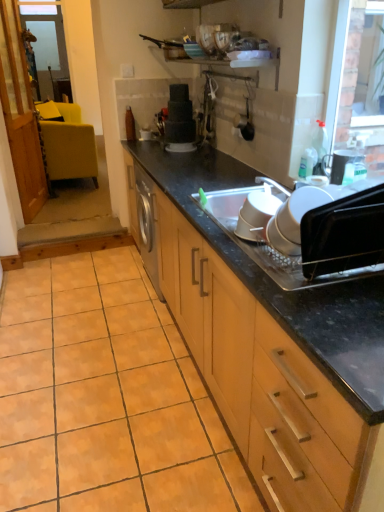
Question: Is black plastic oven at right, the first appliance viewed from the front, thinner than white plastic bowls at center, which ranks as the third appliance in right-to-left order?

Choices:
 (A) no
 (B) yes

Answer: (A)

Question: Is black plastic oven at right, the fourth appliance from the top, positioned in front of white plastic bowls at center, the 3th appliance viewed from the top?

Choices:
 (A) yes
 (B) no

Answer: (A)

Question: From a real-world perspective, is black plastic oven at right, acting as the 2th appliance starting from the right, over white plastic bowls at center, the 3th appliance positioned from the back?

Choices:
 (A) no
 (B) yes

Answer: (B)

Question: Considering the relative sizes of black plastic oven at right, acting as the 2th appliance starting from the right, and white plastic bowls at center, positioned as the 2th appliance in bottom-to-top order, in the image provided, is black plastic oven at right, acting as the 2th appliance starting from the right, wider than white plastic bowls at center, positioned as the 2th appliance in bottom-to-top order,?

Choices:
 (A) yes
 (B) no

Answer: (A)

Question: Does black plastic oven at right, the first appliance viewed from the front, have a larger size compared to white plastic bowls at center, the 3th appliance viewed from the top?

Choices:
 (A) no
 (B) yes

Answer: (B)

Question: In the image, is wooden cabinet at center on the left side or the right side of orange matte tile at lower left?

Choices:
 (A) right
 (B) left

Answer: (A)

Question: Looking at the image, does wooden cabinet at center seem bigger or smaller compared to orange matte tile at lower left?

Choices:
 (A) small
 (B) big

Answer: (B)

Question: Relative to orange matte tile at lower left, is wooden cabinet at center in front or behind?

Choices:
 (A) behind
 (B) front

Answer: (B)

Question: From a real-world perspective, is wooden cabinet at center physically located above or below orange matte tile at lower left?

Choices:
 (A) above
 (B) below

Answer: (A)

Question: Based on their positions, is matte black toaster at upper right, the 2th appliance positioned from the back, located to the left or right of black plastic oven at right, positioned as the fourth appliance in back-to-front order?

Choices:
 (A) right
 (B) left

Answer: (A)

Question: From the image's perspective, is matte black toaster at upper right, the 2th appliance positioned from the back, positioned above or below black plastic oven at right, acting as the 2th appliance starting from the right?

Choices:
 (A) above
 (B) below

Answer: (A)

Question: Is matte black toaster at upper right, the 3th appliance in the front-to-back sequence, situated inside black plastic oven at right, positioned as the fourth appliance in back-to-front order, or outside?

Choices:
 (A) outside
 (B) inside

Answer: (A)

Question: Does point (350, 153) appear closer or farther from the camera than point (362, 227)?

Choices:
 (A) farther
 (B) closer

Answer: (A)

Question: Would you say matte black toaster at upper right, positioned as the 1th appliance in right-to-left order, is inside or outside orange matte tile at lower left?

Choices:
 (A) inside
 (B) outside

Answer: (B)

Question: From the image's perspective, is matte black toaster at upper right, positioned as the 1th appliance in right-to-left order, located above or below orange matte tile at lower left?

Choices:
 (A) below
 (B) above

Answer: (B)